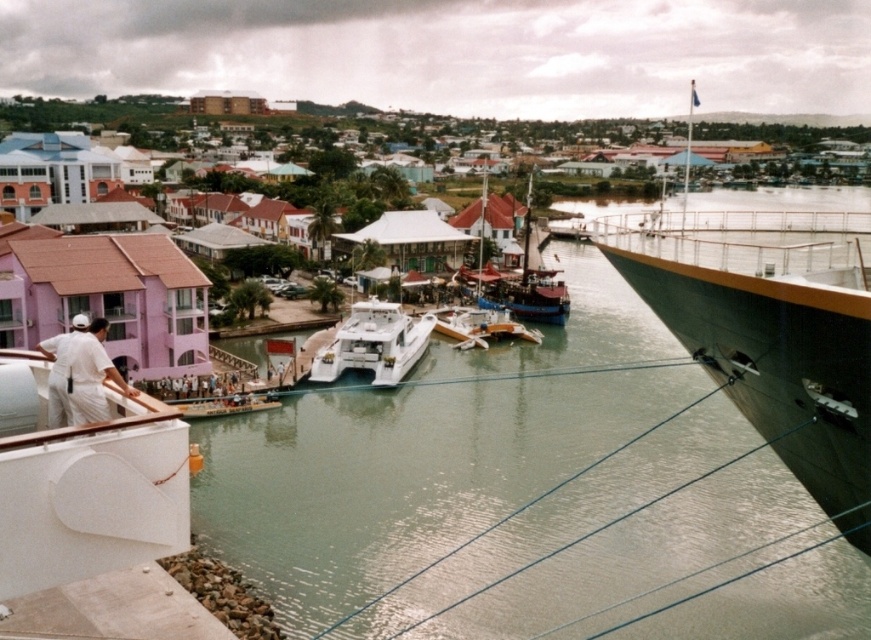
You are standing on the cruise ship deck and want to know the distance between the wooden sailboat at center and the nearest boat in the marina. Can you tell me what it is?

The distance between the wooden sailboat at center and the nearest boat in the marina is 83.95 meters.